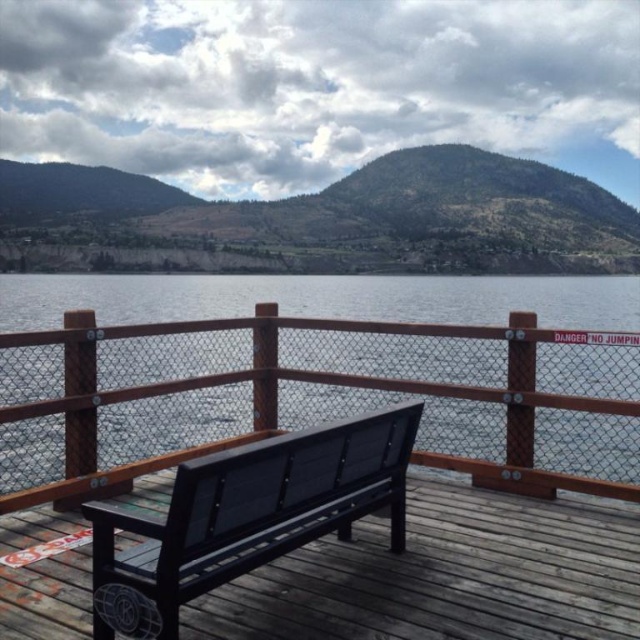
You are standing at point (342, 460) and want to walk to point (200, 410). Based on the scene description, will you be moving forward or backward?

Since point (200, 410) is behind point (342, 460), moving from (342, 460) to (200, 410) would require moving backward.

Looking at this image, you are a painter wanting to capture the scene. You have a canvas that is 2 feet wide. The transparent glass water at center and matte black bench at center are the main subjects. Which object should you focus on to fit within your canvas width?

The transparent glass water at center might be wider than matte black bench at center, so focusing on the transparent glass water at center would be more likely to fit within the 2 feet wide canvas.